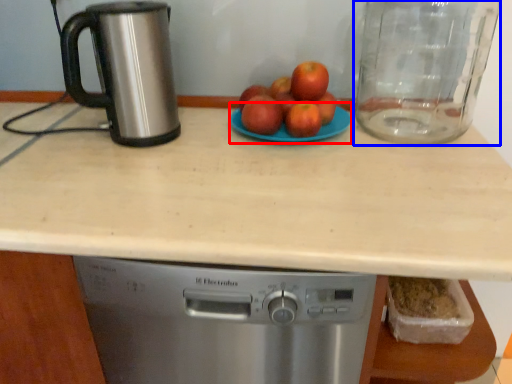
Question: Which object appears farthest to the camera in this image, glass plate (highlighted by a red box) or glass jar (highlighted by a blue box)?

Choices:
 (A) glass plate
 (B) glass jar

Answer: (A)